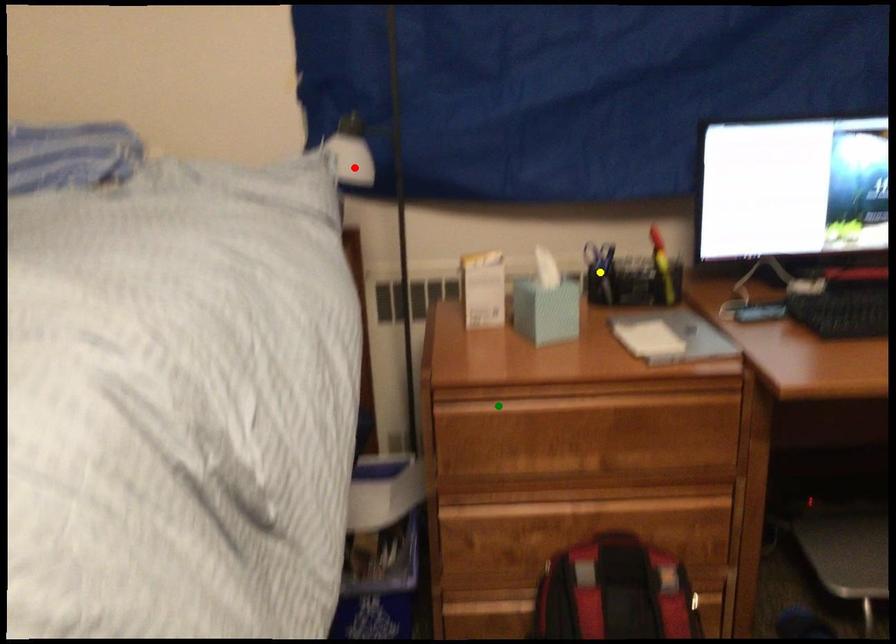
Based on the photo, order these from nearest to farthest:
1. yellow point
2. green point
3. red point

green point → red point → yellow point